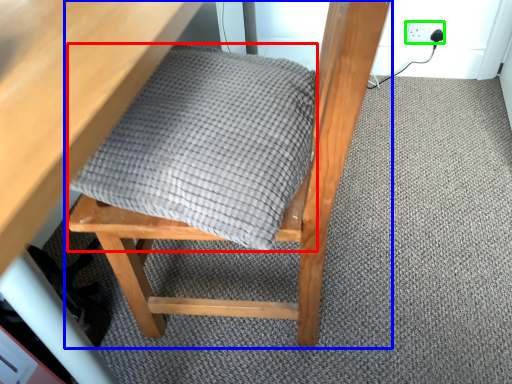
Question: Which object is the closest to the blanket (highlighted by a red box)? Choose among these: chair (highlighted by a blue box) or electric outlet (highlighted by a green box).

Choices:
 (A) chair
 (B) electric outlet

Answer: (A)